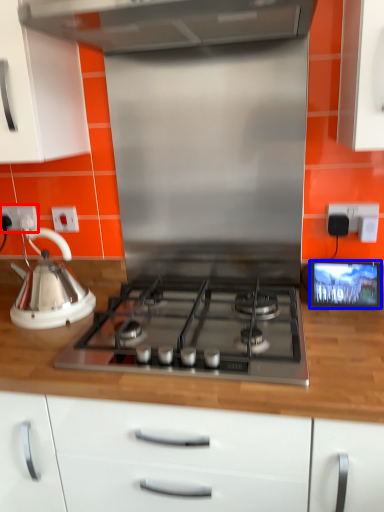
Question: Which of the following is the farthest to the observer, electric outlet (highlighted by a red box) or screen (highlighted by a blue box)?

Choices:
 (A) electric outlet
 (B) screen

Answer: (A)